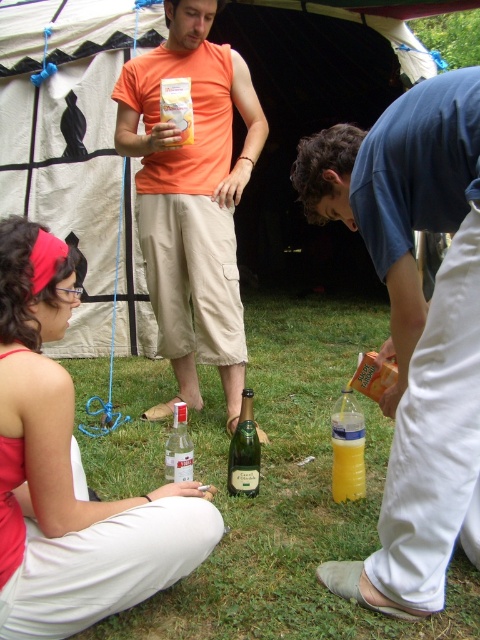
The height and width of the screenshot is (640, 480). What are the coordinates of `matte red bandana at lower left` in the screenshot? It's located at (70, 472).

Between matte red bandana at lower left and translucent plastic bottle at lower center, which one has more height?

Standing taller between the two is matte red bandana at lower left.

You are a GUI agent. You are given a task and a screenshot of the screen. Output one action in this format:
    pyautogui.click(x=<x>, y=<y>)
    Task: Click on the matte red bandana at lower left
    
    Given the screenshot: What is the action you would take?
    pyautogui.click(x=70, y=472)

Locate an element on the screen. matte red bandana at lower left is located at coordinates (70, 472).

The width and height of the screenshot is (480, 640). Identify the location of orange cotton t-shirt at center. tap(192, 198).

From the picture: Does orange cotton t-shirt at center appear on the right side of translucent plastic bottle at lower center?

In fact, orange cotton t-shirt at center is to the left of translucent plastic bottle at lower center.

Is point (216, 113) more distant than point (362, 458)?

Yes, it is.

Where is `orange cotton t-shirt at center`? The width and height of the screenshot is (480, 640). orange cotton t-shirt at center is located at coordinates (192, 198).

Measure the distance between point (205, 209) and camera.

Point (205, 209) is 8.76 feet from camera.

Can you confirm if orange cotton t-shirt at center is positioned to the right of green glass bottle at center?

Incorrect, orange cotton t-shirt at center is not on the right side of green glass bottle at center.

Between point (159, 412) and point (256, 460), which one is positioned in front?

Positioned in front is point (256, 460).

Locate an element on the screen. This screenshot has height=640, width=480. orange cotton t-shirt at center is located at coordinates (192, 198).